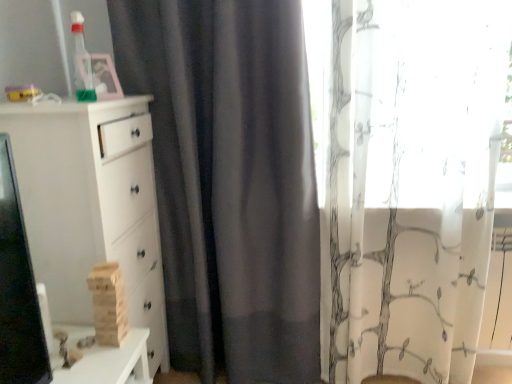
Question: From their relative heights in the image, would you say white sheer curtain at right is taller or shorter than transparent plastic bottle at upper left, which is counted as the 2th toy, starting from the bottom?

Choices:
 (A) tall
 (B) short

Answer: (A)

Question: From the image's perspective, is white sheer curtain at right positioned above or below transparent plastic bottle at upper left, which is counted as the 2th toy, starting from the bottom?

Choices:
 (A) above
 (B) below

Answer: (B)

Question: Which object is the closest to the white matte chest of drawers at left?

Choices:
 (A) wooden blocks at left, which is the 1th toy from bottom to top
 (B) white sheer curtain at right
 (C) transparent plastic bottle at upper left, which is the first toy from left to right

Answer: (A)

Question: Which of these objects is positioned farthest from the white matte chest of drawers at left?

Choices:
 (A) transparent plastic bottle at upper left, which is the first toy from left to right
 (B) wooden blocks at left, which is the first toy from right to left
 (C) white sheer curtain at right

Answer: (C)